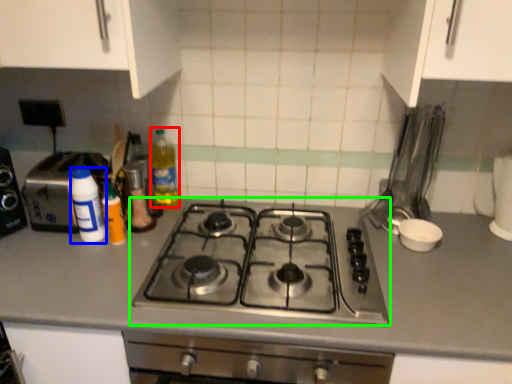
Question: Which object is positioned closest to bottle (highlighted by a red box)? Select from bottle (highlighted by a blue box) and gas stove (highlighted by a green box).

Choices:
 (A) bottle
 (B) gas stove

Answer: (A)